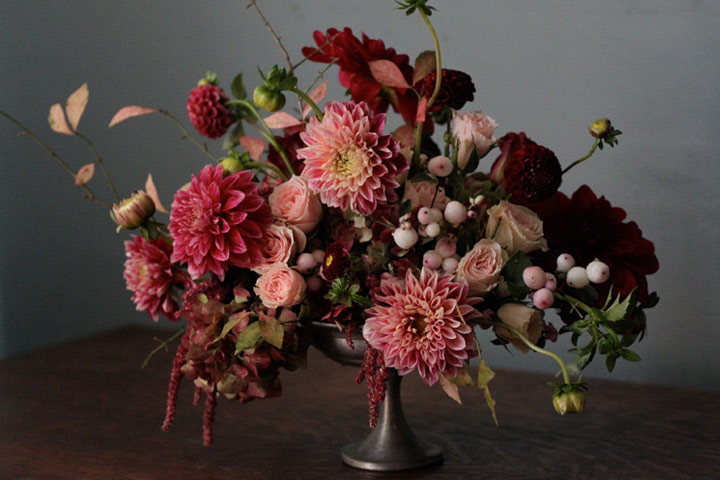
You are a GUI agent. You are given a task and a screenshot of the screen. Output one action in this format:
    pyautogui.click(x=<x>, y=<y>)
    Task: Click on the flower stand
    This screenshot has height=480, width=720.
    Given the screenshot: What is the action you would take?
    pyautogui.click(x=392, y=461), pyautogui.click(x=346, y=346)